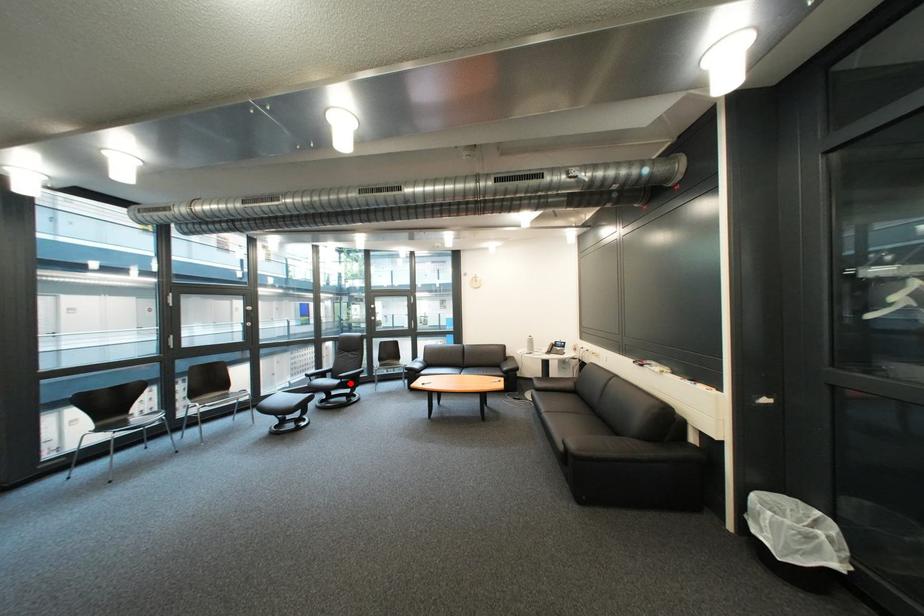
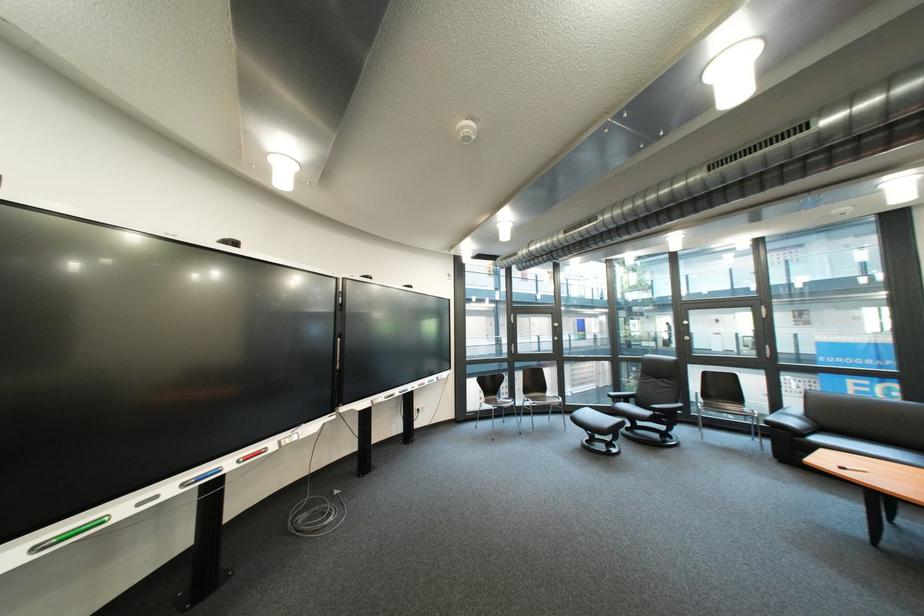
In the second image, find the point that corresponds to the highlighted location in the first image.

(661, 415)